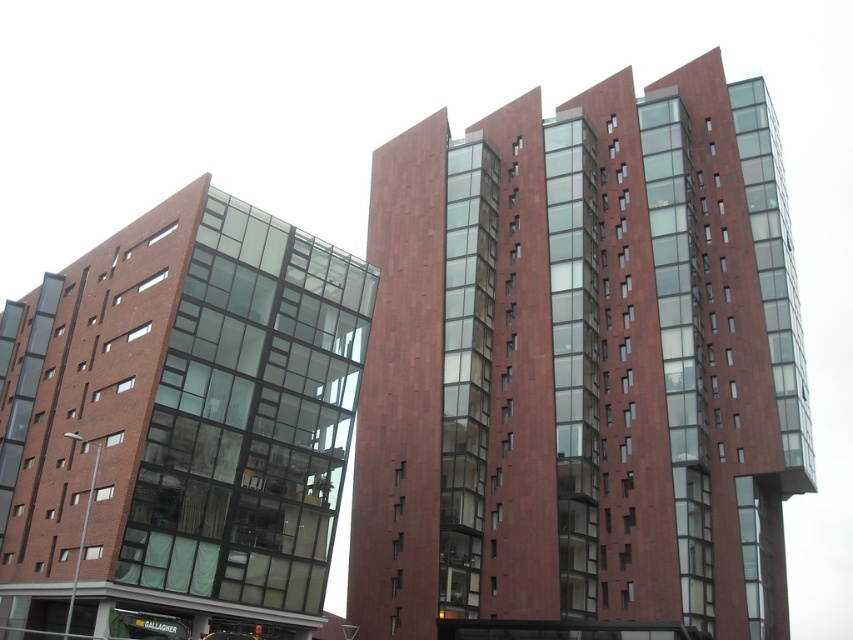
You are an architect analyzing the layout of two buildings in the image. The red brick building at center and the matte brick building at left are both part of the design. If you need to place a new rectangular garden between them, which building should the garden be closer to based on their widths?

The red brick building at center might be wider than matte brick building at left, so the garden should be placed closer to the matte brick building at left to balance the space.

You are standing in front of the two modern highrise buildings. You see a point at (564, 412) and another at (207, 420). Which point is closer to you?

Point (207, 420) is closer to you because it is less further than point (564, 412).

You are standing in front of two buildings. The red brick building at center and the matte brick building at left. Which building is closer to you?

The red brick building at center is closer to you because it is further to the viewer than the matte brick building at left.